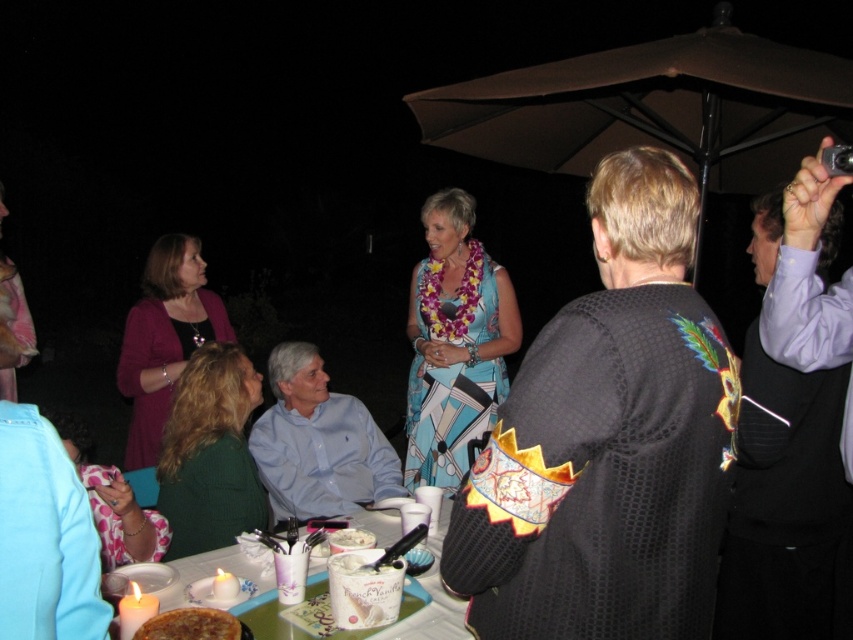
Question: Which object appears farthest from the camera in this image?

Choices:
 (A) white glossy table at center
 (B) black textured jacket at center
 (C) matte purple sweater at left

Answer: (C)

Question: Can you confirm if golden brown crusty pie at lower left is thinner than white paper plate at center?

Choices:
 (A) yes
 (B) no

Answer: (B)

Question: Which point is closer to the camera taking this photo?

Choices:
 (A) (347, 536)
 (B) (311, 456)
 (C) (213, 410)

Answer: (A)

Question: Does green knitted sweater at lower left have a smaller size compared to golden brown crusty pie at lower left?

Choices:
 (A) yes
 (B) no

Answer: (B)

Question: Which is nearer to the white paper plate at center?

Choices:
 (A) black textured jacket at center
 (B) purple shirt at upper right
 (C) white glossy table at center

Answer: (C)

Question: Is purple shirt at upper right wider than golden brown crusty pie at lower left?

Choices:
 (A) yes
 (B) no

Answer: (A)